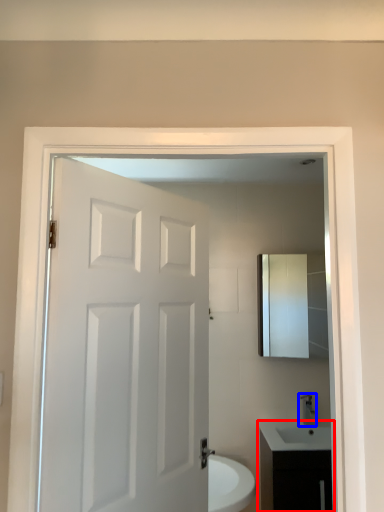
Question: Which point is further to the camera, bathroom cabinet (highlighted by a red box) or tap (highlighted by a blue box)?

Choices:
 (A) bathroom cabinet
 (B) tap

Answer: (B)